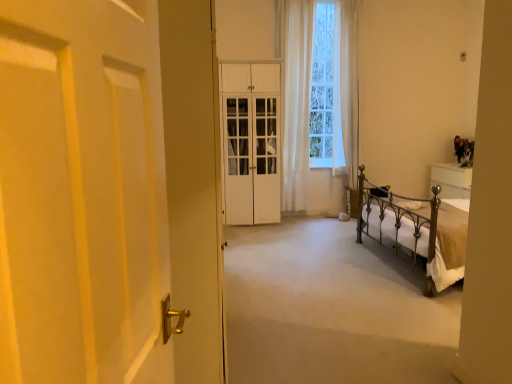
This screenshot has width=512, height=384. In order to click on empty space that is ontop of white carpet at center (from a real-world perspective) in this screenshot , I will do `click(330, 281)`.